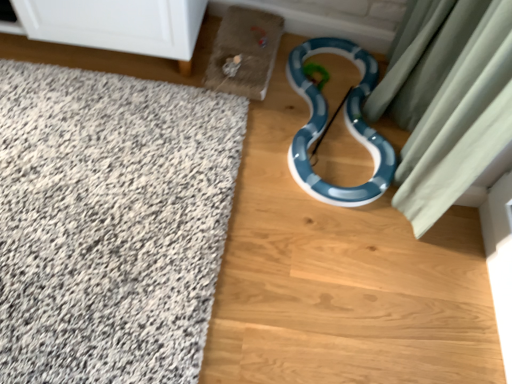
Question: Is white shaggy bath mat at left in front of blue glossy snake at center?

Choices:
 (A) no
 (B) yes

Answer: (B)

Question: From a real-world perspective, is white shaggy bath mat at left positioned under blue glossy snake at center based on gravity?

Choices:
 (A) yes
 (B) no

Answer: (B)

Question: Is white shaggy bath mat at left smaller than blue glossy snake at center?

Choices:
 (A) no
 (B) yes

Answer: (A)

Question: Is white shaggy bath mat at left oriented away from blue glossy snake at center?

Choices:
 (A) yes
 (B) no

Answer: (B)

Question: Does white shaggy bath mat at left appear on the left side of blue glossy snake at center?

Choices:
 (A) yes
 (B) no

Answer: (A)

Question: Looking at the image, does blue glossy dirt track at center-right seem bigger or smaller compared to white shaggy bath mat at left?

Choices:
 (A) big
 (B) small

Answer: (A)

Question: In terms of height, does blue glossy dirt track at center-right look taller or shorter compared to white shaggy bath mat at left?

Choices:
 (A) tall
 (B) short

Answer: (B)

Question: Relative to white shaggy bath mat at left, is blue glossy dirt track at center-right in front or behind?

Choices:
 (A) behind
 (B) front

Answer: (A)

Question: Looking at their shapes, would you say blue glossy dirt track at center-right is wider or thinner than white shaggy bath mat at left?

Choices:
 (A) thin
 (B) wide

Answer: (B)

Question: Based on their sizes in the image, would you say blue glossy snake at center is bigger or smaller than white shaggy bath mat at left?

Choices:
 (A) small
 (B) big

Answer: (A)

Question: Is blue glossy snake at center taller or shorter than white shaggy bath mat at left?

Choices:
 (A) short
 (B) tall

Answer: (A)

Question: From a real-world perspective, is blue glossy snake at center positioned above or below white shaggy bath mat at left?

Choices:
 (A) above
 (B) below

Answer: (B)

Question: Is point (354, 132) positioned closer to the camera than point (99, 223)?

Choices:
 (A) closer
 (B) farther

Answer: (B)

Question: Does point (23, 215) appear closer or farther from the camera than point (311, 120)?

Choices:
 (A) farther
 (B) closer

Answer: (B)

Question: From a real-world perspective, is white shaggy bath mat at left positioned above or below blue glossy snake at center?

Choices:
 (A) above
 (B) below

Answer: (A)